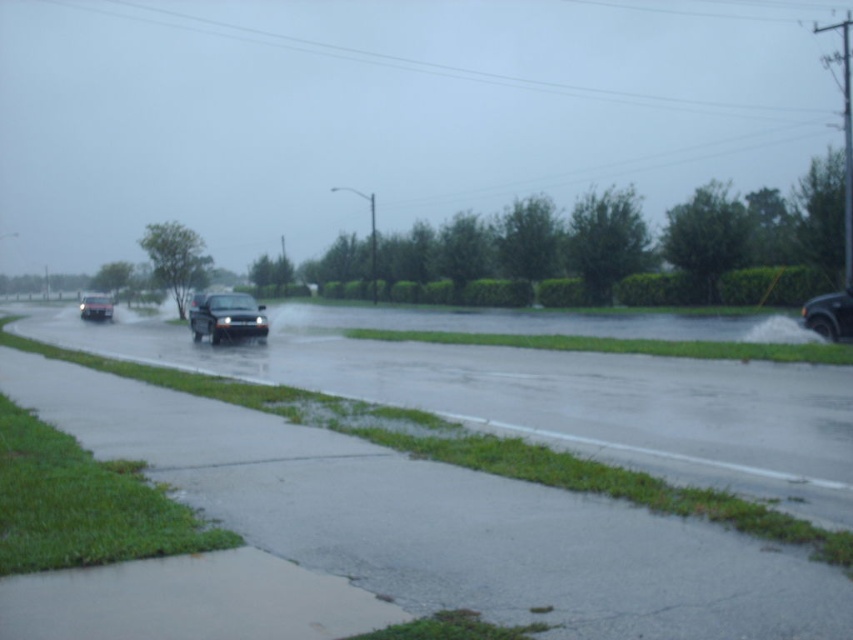
Is the position of smokey gray metallic car at center less distant than that of metallic silver suv at lower right?

No.

Does point (265, 332) come closer to viewer compared to point (833, 300)?

No, it is not.

The width and height of the screenshot is (853, 640). What are the coordinates of `smokey gray metallic car at center` in the screenshot? It's located at (225, 316).

Based on the photo, which is more to the right, metallic silver suv at lower right or matte black truck at center?

metallic silver suv at lower right is more to the right.

Which of these two, metallic silver suv at lower right or matte black truck at center, stands taller?

Standing taller between the two is matte black truck at center.

This screenshot has width=853, height=640. In order to click on metallic silver suv at lower right in this screenshot , I will do `click(828, 314)`.

Is point (222, 326) positioned behind point (82, 301)?

No, (222, 326) is closer to viewer.

Is point (238, 296) positioned before point (103, 307)?

Yes, it is in front of point (103, 307).

Locate an element on the screen. smokey gray metallic car at center is located at coordinates (225, 316).